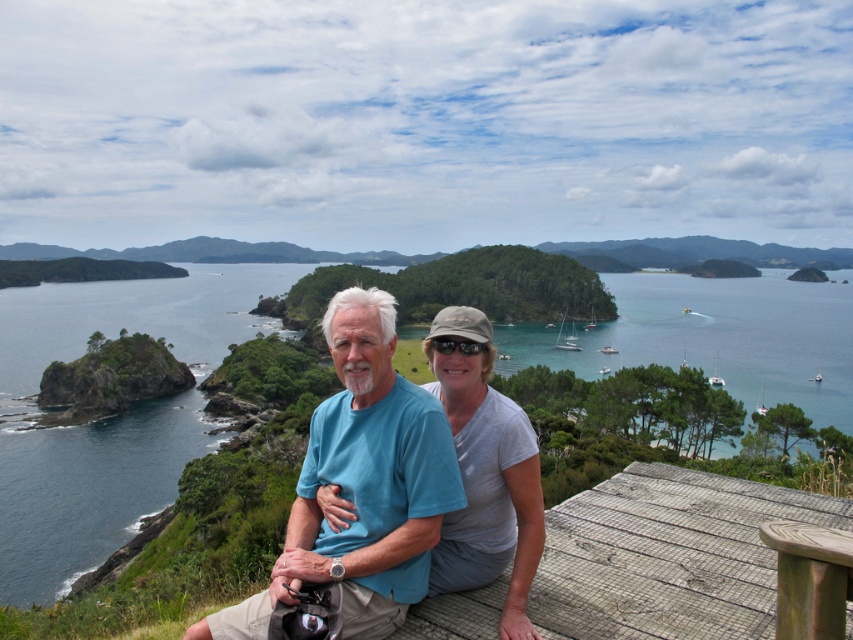
Question: Estimate the real-world distances between objects in this image. Which object is farther from the gray cotton shirt at center?

Choices:
 (A) wooden picnic table at lower right
 (B) blue cotton t-shirt at center
 (C) blue water at left

Answer: (C)

Question: Does blue water at left lie in front of gray cotton shirt at center?

Choices:
 (A) no
 (B) yes

Answer: (A)

Question: Observing the image, what is the correct spatial positioning of blue water at left in reference to wooden picnic table at lower right?

Choices:
 (A) above
 (B) below

Answer: (A)

Question: Is the position of blue cotton t-shirt at center more distant than that of gray cotton shirt at center?

Choices:
 (A) yes
 (B) no

Answer: (B)

Question: Which object is positioned farthest from the wooden picnic table at lower right?

Choices:
 (A) blue cotton t-shirt at center
 (B) gray cotton shirt at center

Answer: (A)

Question: Which of the following is the farthest from the observer?

Choices:
 (A) (505, 467)
 (B) (444, 448)

Answer: (A)